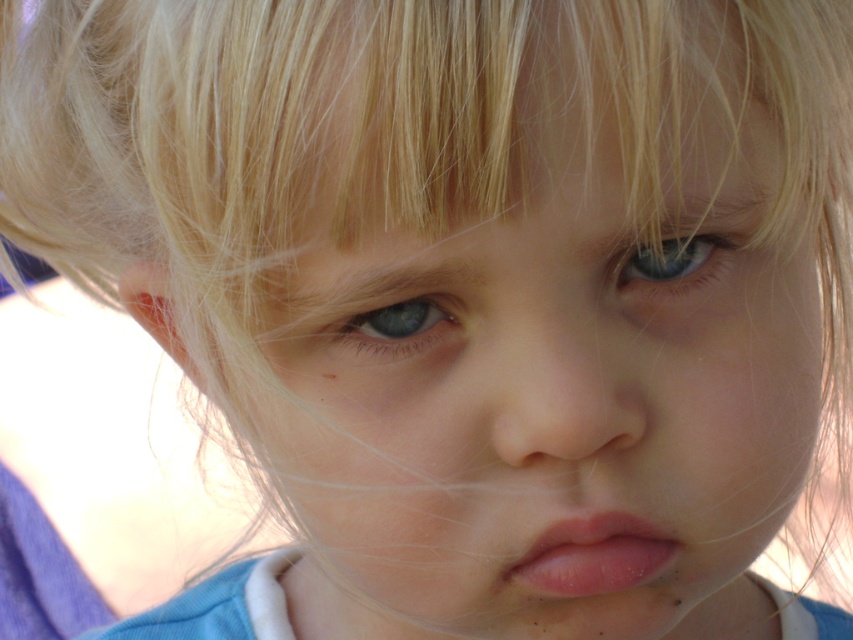
Question: Does pink smooth lips at center have a larger size compared to blue matte eye at center?

Choices:
 (A) no
 (B) yes

Answer: (B)

Question: Does smooth flesh nose at center have a lesser width compared to blue glossy eye at upper center?

Choices:
 (A) yes
 (B) no

Answer: (B)

Question: Which point is farther to the camera?

Choices:
 (A) (546, 305)
 (B) (650, 268)
 (C) (357, 317)

Answer: (B)

Question: From the image, what is the correct spatial relationship of smooth flesh nose at center in relation to blue matte eye at center?

Choices:
 (A) right
 (B) left

Answer: (A)

Question: Which object is the closest to the blue matte eye at center?

Choices:
 (A) smooth flesh nose at center
 (B) pink smooth lips at center
 (C) blue glossy eye at upper center

Answer: (A)

Question: Which point is closer to the camera?

Choices:
 (A) blue glossy eye at upper center
 (B) blue matte eye at center
 (C) pink smooth lips at center
 (D) smooth flesh nose at center

Answer: (D)